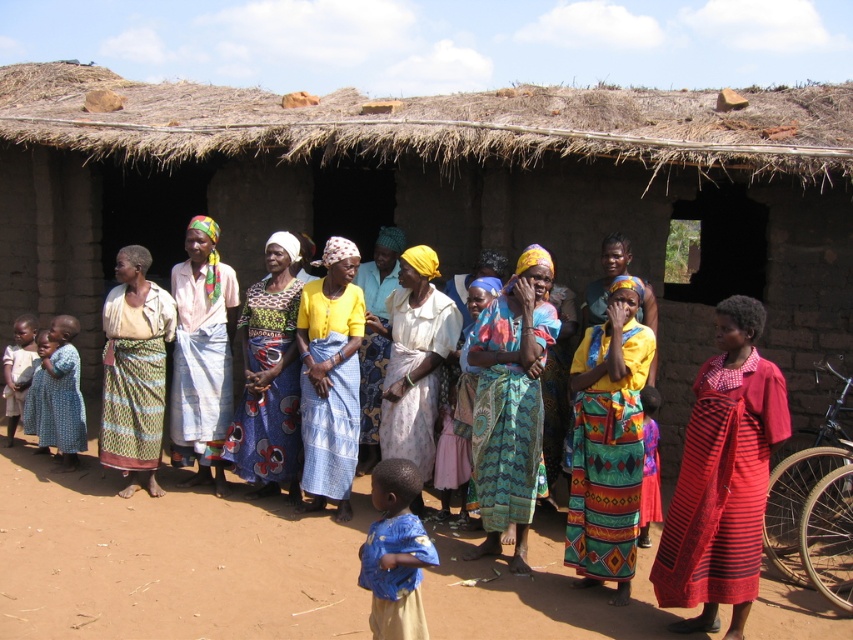
How distant is multicolored woven cloth at center from printed fabric dress at center?

A distance of 5.88 feet exists between multicolored woven cloth at center and printed fabric dress at center.

Between multicolored woven cloth at center and printed fabric dress at center, which one is positioned higher?

printed fabric dress at center

Is point (524, 525) positioned before point (244, 445)?

Yes, it is.

Find the location of `multicolored woven cloth at center`. multicolored woven cloth at center is located at coordinates (511, 404).

Measure the distance between point (718,452) and camera.

Point (718,452) and camera are 5.23 meters apart from each other.

Can you confirm if red striped fabric at center is taller than yellow fabric dress at center?

In fact, red striped fabric at center may be shorter than yellow fabric dress at center.

What do you see at coordinates (722, 477) in the screenshot? This screenshot has height=640, width=853. I see `red striped fabric at center` at bounding box center [722, 477].

Locate an element on the screen. This screenshot has height=640, width=853. red striped fabric at center is located at coordinates (722, 477).

Describe the element at coordinates (57, 396) in the screenshot. Image resolution: width=853 pixels, height=640 pixels. I see `blue printed dress at lower left` at that location.

Is point (70, 346) in front of point (9, 406)?

That is True.

Locate an element on the screen. This screenshot has width=853, height=640. blue printed dress at lower left is located at coordinates (57, 396).